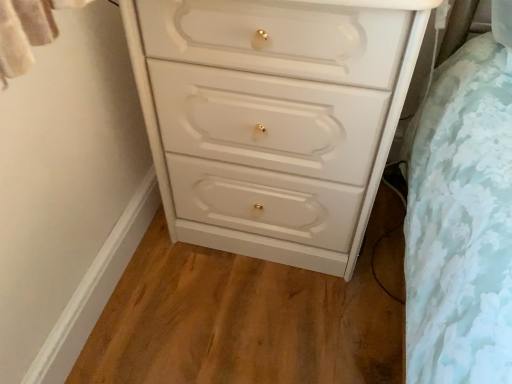
Locate an element on the screen. white glossy chest of drawers at center is located at coordinates (269, 122).

In order to face white glossy chest of drawers at center, should I rotate leftwards or rightwards?

You should look right and rotate roughly 3.281 degrees.

What do you see at coordinates (269, 122) in the screenshot? I see `white glossy chest of drawers at center` at bounding box center [269, 122].

Find the location of a particular element. Image resolution: width=512 pixels, height=384 pixels. white glossy chest of drawers at center is located at coordinates (269, 122).